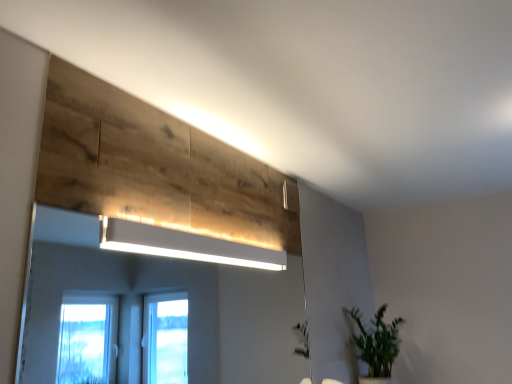
Question: From a real-world perspective, is white glossy mirror at upper center beneath green leafy plant at lower right?

Choices:
 (A) no
 (B) yes

Answer: (A)

Question: Is white glossy mirror at upper center facing towards green leafy plant at lower right?

Choices:
 (A) yes
 (B) no

Answer: (B)

Question: Does white glossy mirror at upper center appear on the right side of green leafy plant at lower right?

Choices:
 (A) no
 (B) yes

Answer: (A)

Question: Considering the relative sizes of white glossy mirror at upper center and green leafy plant at lower right in the image provided, is white glossy mirror at upper center thinner than green leafy plant at lower right?

Choices:
 (A) yes
 (B) no

Answer: (A)

Question: From the image's perspective, does white glossy mirror at upper center appear lower than green leafy plant at lower right?

Choices:
 (A) no
 (B) yes

Answer: (A)

Question: From a real-world perspective, is white glossy mirror at upper center positioned over green leafy plant at lower right based on gravity?

Choices:
 (A) yes
 (B) no

Answer: (A)

Question: Can you confirm if green leafy plant at lower right is positioned to the right of white glossy mirror at upper center?

Choices:
 (A) yes
 (B) no

Answer: (A)

Question: Is green leafy plant at lower right smaller than white glossy mirror at upper center?

Choices:
 (A) no
 (B) yes

Answer: (A)

Question: From the image's perspective, is green leafy plant at lower right beneath white glossy mirror at upper center?

Choices:
 (A) no
 (B) yes

Answer: (B)

Question: Is green leafy plant at lower right positioned with its back to white glossy mirror at upper center?

Choices:
 (A) no
 (B) yes

Answer: (A)

Question: Considering the relative positions of green leafy plant at lower right and white glossy mirror at upper center in the image provided, is green leafy plant at lower right in front of white glossy mirror at upper center?

Choices:
 (A) yes
 (B) no

Answer: (B)

Question: Is green leafy plant at lower right shorter than white glossy mirror at upper center?

Choices:
 (A) yes
 (B) no

Answer: (A)

Question: Is white matte rectangular light at upper center in front of green leafy plant at lower right?

Choices:
 (A) yes
 (B) no

Answer: (A)